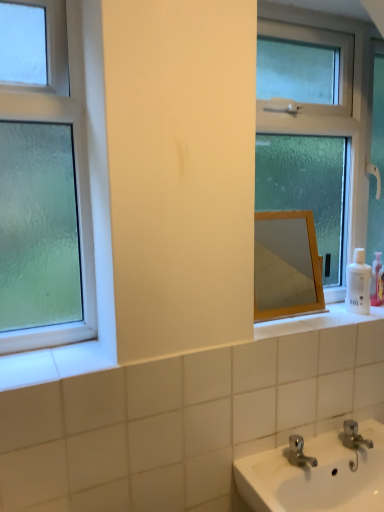
The width and height of the screenshot is (384, 512). Describe the element at coordinates (358, 284) in the screenshot. I see `white plastic bottle at right` at that location.

The width and height of the screenshot is (384, 512). Describe the element at coordinates (79, 207) in the screenshot. I see `green frosted glass window at left, which is the second window in back-to-front order` at that location.

Looking at this image, what is the approximate width of wooden mirror at center?

wooden mirror at center is 4.08 inches in width.

What do you see at coordinates (330, 115) in the screenshot? I see `clear glass window at center, marked as the first window in a back-to-front arrangement` at bounding box center [330, 115].

Find the location of a particular element. Image resolution: width=384 pixels, height=512 pixels. white plastic bottle at right is located at coordinates (358, 284).

Which is closer, [301,21] or [363,295]?

Clearly, point [301,21] is closer to the camera than point [363,295].

Image resolution: width=384 pixels, height=512 pixels. I want to click on window that is the 1st one when counting forward from the white plastic bottle at right, so click(330, 115).

In terms of width, does clear glass window at center, marked as the first window in a back-to-front arrangement, look wider or thinner when compared to white plastic bottle at right?

Considering their sizes, clear glass window at center, marked as the first window in a back-to-front arrangement, looks broader than white plastic bottle at right.

Considering the relative positions of green frosted glass window at left, positioned as the first window in front-to-back order, and clear glass window at center, placed as the 2th window when sorted from left to right, in the image provided, is green frosted glass window at left, positioned as the first window in front-to-back order, behind clear glass window at center, placed as the 2th window when sorted from left to right,?

No, green frosted glass window at left, positioned as the first window in front-to-back order, is in front of clear glass window at center, placed as the 2th window when sorted from left to right.

Can you confirm if green frosted glass window at left, marked as the second window in a right-to-left arrangement, is positioned to the right of clear glass window at center, marked as the first window in a back-to-front arrangement?

Incorrect, green frosted glass window at left, marked as the second window in a right-to-left arrangement, is not on the right side of clear glass window at center, marked as the first window in a back-to-front arrangement.

Is green frosted glass window at left, the 1th window viewed from the left, with clear glass window at center, marked as the first window in a back-to-front arrangement?

No, green frosted glass window at left, the 1th window viewed from the left, is not with clear glass window at center, marked as the first window in a back-to-front arrangement.

Can you confirm if green frosted glass window at left, positioned as the first window in front-to-back order, is wider than clear glass window at center, placed as the 2th window when sorted from left to right?

No, green frosted glass window at left, positioned as the first window in front-to-back order, is not wider than clear glass window at center, placed as the 2th window when sorted from left to right.

Which is more to the left, wooden mirror at center or clear glass window at center, arranged as the second window when viewed from the front?

wooden mirror at center.

Between wooden mirror at center and clear glass window at center, marked as the first window in a back-to-front arrangement, which one has smaller size?

wooden mirror at center.

Is point (292, 305) closer to viewer compared to point (333, 131)?

No.

Which object is further away from the camera, clear glass window at center, placed as the 2th window when sorted from left to right, or wooden mirror at center?

wooden mirror at center.

In terms of size, does clear glass window at center, which ranks as the first window in right-to-left order, appear bigger or smaller than wooden mirror at center?

Considering their sizes, clear glass window at center, which ranks as the first window in right-to-left order, takes up more space than wooden mirror at center.

Does clear glass window at center, marked as the first window in a back-to-front arrangement, contain wooden mirror at center?

Definitely not — wooden mirror at center is not inside clear glass window at center, marked as the first window in a back-to-front arrangement.

What's the angular difference between clear glass window at center, placed as the 2th window when sorted from left to right, and wooden mirror at center's facing directions?

0.425 degrees.

From the image's perspective, is wooden mirror at center over green frosted glass window at left, marked as the second window in a right-to-left arrangement?

Incorrect, from the image's perspective, wooden mirror at center is lower than green frosted glass window at left, marked as the second window in a right-to-left arrangement.

Considering the relative sizes of wooden mirror at center and green frosted glass window at left, the 1th window viewed from the left, in the image provided, is wooden mirror at center smaller than green frosted glass window at left, the 1th window viewed from the left,?

Indeed, wooden mirror at center has a smaller size compared to green frosted glass window at left, the 1th window viewed from the left.

Measure the distance between wooden mirror at center and green frosted glass window at left, which is the second window in back-to-front order.

A distance of 1.48 meters exists between wooden mirror at center and green frosted glass window at left, which is the second window in back-to-front order.

This screenshot has width=384, height=512. Find the location of `the 2nd window in front of the wooden mirror at center`. the 2nd window in front of the wooden mirror at center is located at coordinates (x=79, y=207).

Is clear glass window at center, marked as the first window in a back-to-front arrangement, turned away from green frosted glass window at left, positioned as the first window in front-to-back order?

No, clear glass window at center, marked as the first window in a back-to-front arrangement,'s orientation is not away from green frosted glass window at left, positioned as the first window in front-to-back order.

Does clear glass window at center, arranged as the second window when viewed from the front, come behind green frosted glass window at left, which is the second window in back-to-front order?

Yes.

Which is more to the left, clear glass window at center, placed as the 2th window when sorted from left to right, or green frosted glass window at left, which is the second window in back-to-front order?

From the viewer's perspective, green frosted glass window at left, which is the second window in back-to-front order, appears more on the left side.

From a real-world perspective, is green frosted glass window at left, marked as the second window in a right-to-left arrangement, on wooden mirror at center?

Yes, from a real-world perspective, green frosted glass window at left, marked as the second window in a right-to-left arrangement, is over wooden mirror at center

In terms of height, does green frosted glass window at left, which is the second window in back-to-front order, look taller or shorter compared to wooden mirror at center?

green frosted glass window at left, which is the second window in back-to-front order, is taller than wooden mirror at center.

Is green frosted glass window at left, marked as the second window in a right-to-left arrangement, looking in the opposite direction of wooden mirror at center?

green frosted glass window at left, marked as the second window in a right-to-left arrangement, does not have its back to wooden mirror at center.

The width and height of the screenshot is (384, 512). Find the location of `toiletry that is below the clear glass window at center, marked as the first window in a back-to-front arrangement (from the image's perspective)`. toiletry that is below the clear glass window at center, marked as the first window in a back-to-front arrangement (from the image's perspective) is located at coordinates (358, 284).

In the image, there is a green frosted glass window at left, positioned as the first window in front-to-back order. What are the coordinates of `window above it (from the image's perspective)` in the screenshot? It's located at (330, 115).

Based on their spatial positions, is white plastic bottle at right or clear glass window at center, placed as the 2th window when sorted from left to right, closer to green frosted glass window at left, the 1th window viewed from the left?

The object closer to green frosted glass window at left, the 1th window viewed from the left, is clear glass window at center, placed as the 2th window when sorted from left to right.

Based on their spatial positions, is green frosted glass window at left, marked as the second window in a right-to-left arrangement, or clear glass window at center, marked as the first window in a back-to-front arrangement, closer to white plastic bottle at right?

Among the two, clear glass window at center, marked as the first window in a back-to-front arrangement, is located nearer to white plastic bottle at right.

Consider the image. Based on their spatial positions, is green frosted glass window at left, the 1th window viewed from the left, or clear glass window at center, placed as the 2th window when sorted from left to right, further from wooden mirror at center?

The object further to wooden mirror at center is green frosted glass window at left, the 1th window viewed from the left.

Looking at this image, looking at the image, which one is located closer to green frosted glass window at left, positioned as the first window in front-to-back order, wooden mirror at center or white plastic bottle at right?

white plastic bottle at right is closer to green frosted glass window at left, positioned as the first window in front-to-back order.

Estimate the real-world distances between objects in this image. Which object is further from white plastic bottle at right, clear glass window at center, arranged as the second window when viewed from the front, or green frosted glass window at left, which is the second window in back-to-front order?

Among the two, green frosted glass window at left, which is the second window in back-to-front order, is located further to white plastic bottle at right.

Which object lies further to the anchor point clear glass window at center, marked as the first window in a back-to-front arrangement, green frosted glass window at left, positioned as the first window in front-to-back order, or wooden mirror at center?

The object further to clear glass window at center, marked as the first window in a back-to-front arrangement, is wooden mirror at center.

Which object lies further to the anchor point white plastic bottle at right, wooden mirror at center or clear glass window at center, arranged as the second window when viewed from the front?

wooden mirror at center.

Based on their spatial positions, is green frosted glass window at left, which is the second window in back-to-front order, or white plastic bottle at right closer to clear glass window at center, arranged as the second window when viewed from the front?

white plastic bottle at right lies closer to clear glass window at center, arranged as the second window when viewed from the front, than the other object.

Identify the location of mirror situated between green frosted glass window at left, which is the second window in back-to-front order, and white plastic bottle at right from left to right. (283, 264).

Locate an element on the screen. The width and height of the screenshot is (384, 512). window located between green frosted glass window at left, positioned as the first window in front-to-back order, and white plastic bottle at right in the left-right direction is located at coordinates (330, 115).

The image size is (384, 512). Identify the location of mirror between clear glass window at center, placed as the 2th window when sorted from left to right, and white plastic bottle at right in the up-down direction. (283, 264).

Where is `mirror between green frosted glass window at left, the 1th window viewed from the left, and clear glass window at center, arranged as the second window when viewed from the front, in the horizontal direction`? The image size is (384, 512). mirror between green frosted glass window at left, the 1th window viewed from the left, and clear glass window at center, arranged as the second window when viewed from the front, in the horizontal direction is located at coordinates (283, 264).